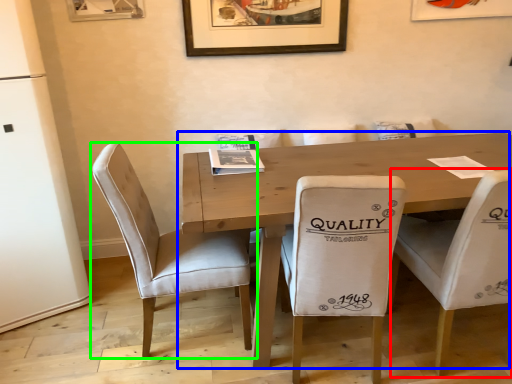
Question: Which object is positioned closest to chair (highlighted by a red box)? Select from table (highlighted by a blue box) and chair (highlighted by a green box).

Choices:
 (A) table
 (B) chair

Answer: (A)